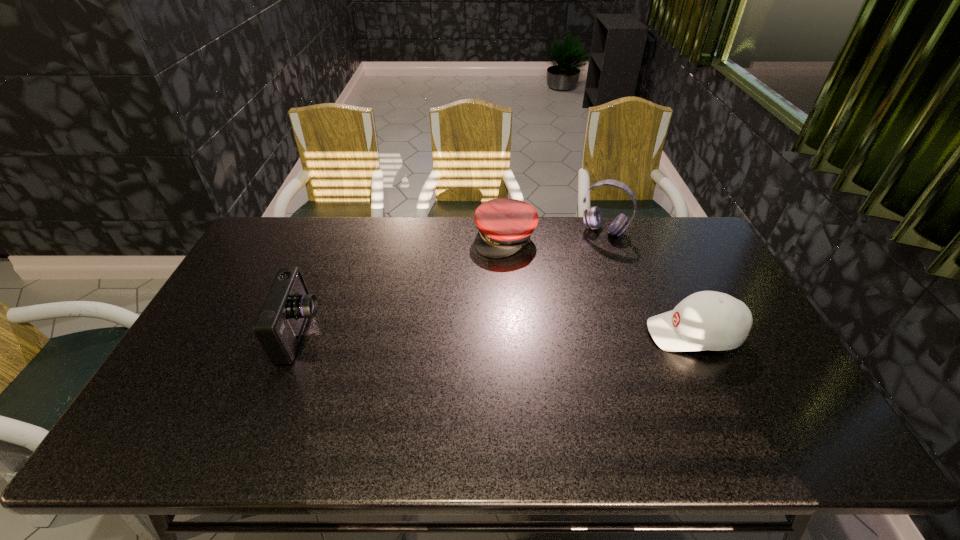
This screenshot has width=960, height=540. In order to click on vacant space located 0.340m on the front of the cap with an emblem in this screenshot , I will do `click(462, 330)`.

Find the location of a particular element. free space located on the front of the cap with an emblem is located at coordinates (468, 315).

This screenshot has width=960, height=540. I want to click on free space located 0.390m on the front of the cap with an emblem, so click(455, 343).

Locate an element on the screen. The image size is (960, 540). free space located 0.390m on the headband and ear cups of the tallest object is located at coordinates (556, 310).

I want to click on free location located on the headband and ear cups of the tallest object, so click(x=563, y=298).

At what (x,y) coordinates should I click in order to perform the action: click on vacant space located on the headband and ear cups of the tallest object. Please return your answer as a coordinate pair (x, y). Image resolution: width=960 pixels, height=540 pixels. Looking at the image, I should click on (591, 247).

Where is `cap present at the far edge`? cap present at the far edge is located at coordinates (505, 225).

Locate an element on the screen. Image resolution: width=960 pixels, height=540 pixels. headset located at the far edge is located at coordinates (592, 218).

Identify the location of object present at the right edge. The image size is (960, 540). (708, 320).

Locate an element on the screen. The width and height of the screenshot is (960, 540). free spot at the far edge of the desktop is located at coordinates (375, 255).